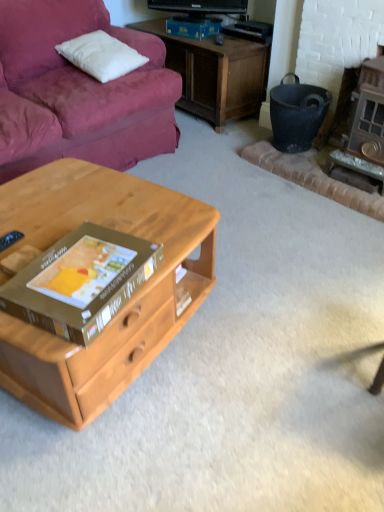
Where is `vacant area on the back side of brown cardboard box at center`? vacant area on the back side of brown cardboard box at center is located at coordinates (111, 217).